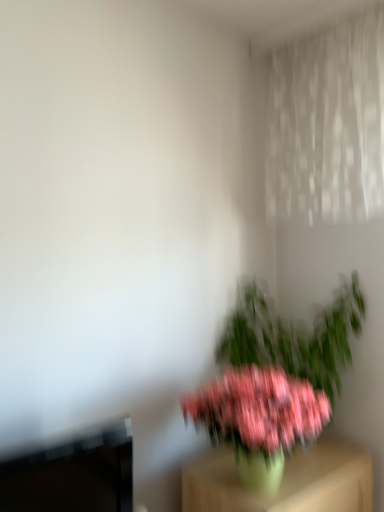
Question: Does pink matte plant at center come in front of pink matte flower at center?

Choices:
 (A) no
 (B) yes

Answer: (A)

Question: Considering the relative sizes of pink matte plant at center and pink matte flower at center in the image provided, is pink matte plant at center wider than pink matte flower at center?

Choices:
 (A) yes
 (B) no

Answer: (A)

Question: Is pink matte plant at center not close to pink matte flower at center?

Choices:
 (A) yes
 (B) no

Answer: (B)

Question: From the image's perspective, is pink matte plant at center over pink matte flower at center?

Choices:
 (A) no
 (B) yes

Answer: (B)

Question: Does pink matte plant at center have a lesser width compared to pink matte flower at center?

Choices:
 (A) no
 (B) yes

Answer: (A)

Question: Considering the positions of pink matte plant at center and green matte vase at lower right in the image, is pink matte plant at center taller or shorter than green matte vase at lower right?

Choices:
 (A) short
 (B) tall

Answer: (B)

Question: From a real-world perspective, is pink matte plant at center positioned above or below green matte vase at lower right?

Choices:
 (A) above
 (B) below

Answer: (A)

Question: Considering their positions, is pink matte plant at center located in front of or behind green matte vase at lower right?

Choices:
 (A) front
 (B) behind

Answer: (B)

Question: Considering the relative positions of pink matte plant at center and green matte vase at lower right in the image provided, is pink matte plant at center to the left or to the right of green matte vase at lower right?

Choices:
 (A) left
 (B) right

Answer: (B)

Question: Is point (192, 500) closer or farther from the camera than point (216, 361)?

Choices:
 (A) farther
 (B) closer

Answer: (B)

Question: In terms of height, does green matte vase at lower right look taller or shorter compared to pink matte plant at center?

Choices:
 (A) tall
 (B) short

Answer: (B)

Question: Is green matte vase at lower right in front of or behind pink matte plant at center in the image?

Choices:
 (A) behind
 (B) front

Answer: (B)

Question: From a real-world perspective, relative to pink matte plant at center, is green matte vase at lower right vertically above or below?

Choices:
 (A) below
 (B) above

Answer: (A)

Question: Which is correct: pink matte flower at center is inside pink matte plant at center, or outside of it?

Choices:
 (A) outside
 (B) inside

Answer: (A)

Question: From the image's perspective, is pink matte flower at center located above or below pink matte plant at center?

Choices:
 (A) above
 (B) below

Answer: (B)